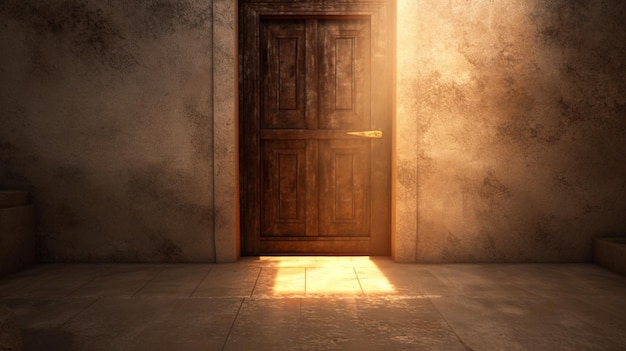
You are a GUI agent. You are given a task and a screenshot of the screen. Output one action in this format:
    pyautogui.click(x=<x>, y=<y>)
    Task: Click on the gap under door
    The image size is (626, 351).
    Given the screenshot: What is the action you would take?
    pyautogui.click(x=315, y=254)